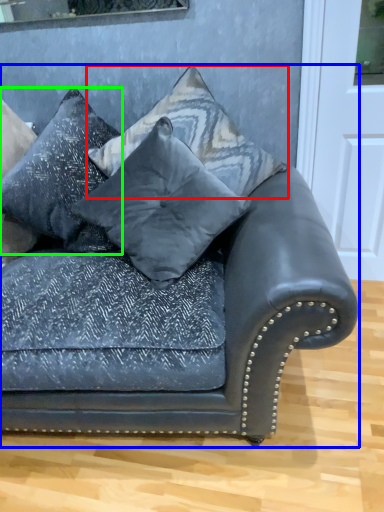
Question: Considering the real-world distances, which object is closest to pillow (highlighted by a red box)? studio couch (highlighted by a blue box) or pillow (highlighted by a green box).

Choices:
 (A) studio couch
 (B) pillow

Answer: (B)